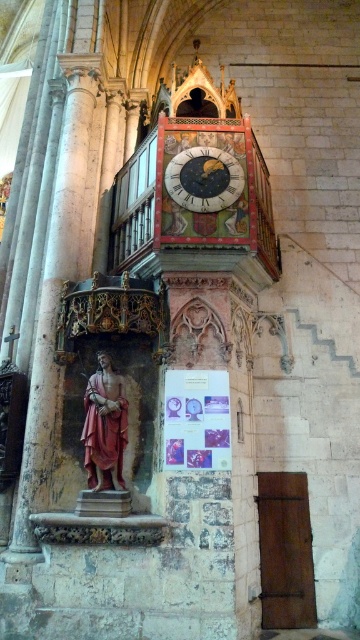
You are standing inside the church and want to take a photo of the gold textured clock at center without the white marble column at left blocking the view. Is this possible from your current position?

The white marble column at left is in front of the gold textured clock at center, so you cannot take a photo of the gold textured clock at center without the white marble column at left blocking the view from your current position.

You are standing in the historical church or cathedral depicted in the image. You notice a point marked at coordinates (x=105, y=426). Based on the scene description, can you identify what object is located at that point?

The point at coordinates (x=105, y=426) corresponds to the matte pink statue at center.

You are an architect examining the interior of a historical church. You notice the white marble column at left and the matte pink statue at center. From your vantage point, which object is positioned higher in the scene?

The white marble column at left is located above the matte pink statue at center, so it is positioned higher in the scene.